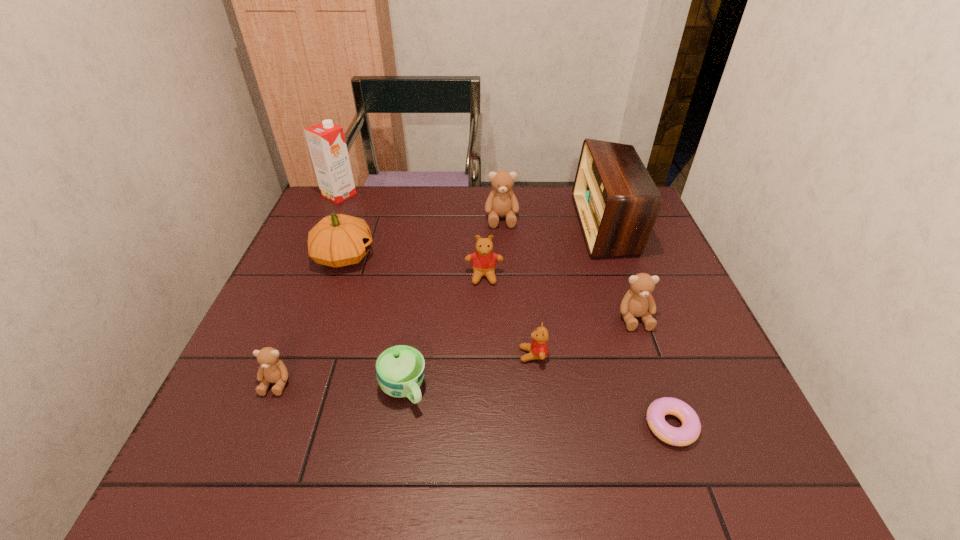
Find the location of a particular element. Image resolution: width=960 pixels, height=540 pixels. brown teddy bear that stands as the closest to the nearest teddy bear is located at coordinates pyautogui.click(x=501, y=202).

You are a GUI agent. You are given a task and a screenshot of the screen. Output one action in this format:
    pyautogui.click(x=<x>, y=<y>)
    Task: Click on the brown teddy bear that can be found as the second closest to the bigger red teddy bear
    
    Given the screenshot: What is the action you would take?
    pyautogui.click(x=638, y=301)

You are a GUI agent. You are given a task and a screenshot of the screen. Output one action in this format:
    pyautogui.click(x=<x>, y=<y>)
    Task: Click on the free spot that satisfies the following two spatial constraints: 1. on the front-facing side of the leftmost teddy bear; 2. on the left side of the shortest object
    The image size is (960, 540).
    Given the screenshot: What is the action you would take?
    pyautogui.click(x=259, y=425)

Where is `free spot that satisfies the following two spatial constraints: 1. on the front-facing side of the left red teddy bear; 2. on the right side of the doughnut`? free spot that satisfies the following two spatial constraints: 1. on the front-facing side of the left red teddy bear; 2. on the right side of the doughnut is located at coordinates (486, 425).

Find the location of a particular element. The width and height of the screenshot is (960, 540). free location that satisfies the following two spatial constraints: 1. on the front-facing side of the fourth nearest teddy bear; 2. on the left side of the doughnut is located at coordinates (486, 425).